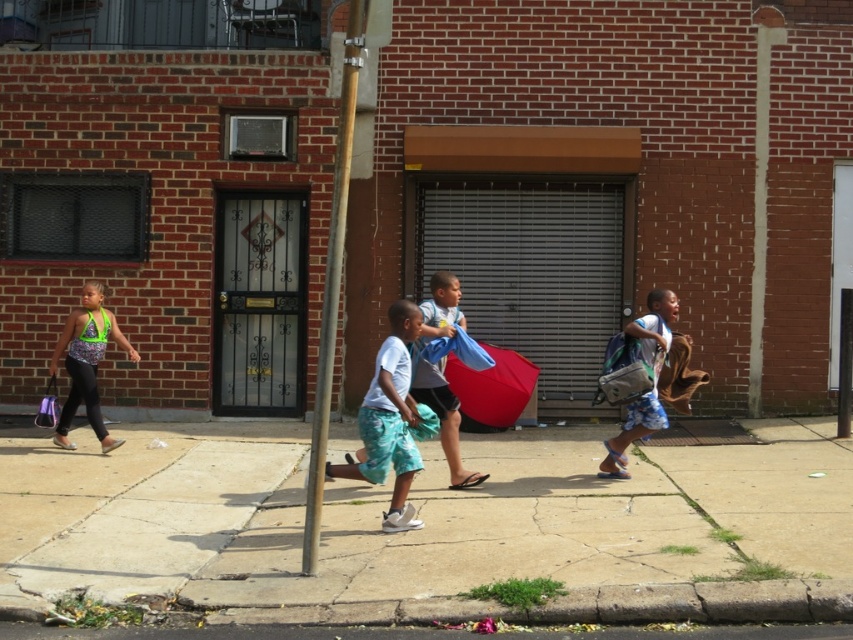
Question: Which point is farther to the camera?

Choices:
 (A) (326, 326)
 (B) (221, 385)

Answer: (B)

Question: Does black metal/gate at center appear on the left side of light blue cotton shorts at center?

Choices:
 (A) yes
 (B) no

Answer: (A)

Question: Can you confirm if smooth concrete sidewalk at center is positioned below matte purple shopping bag at lower left?

Choices:
 (A) no
 (B) yes

Answer: (B)

Question: In this image, where is light blue fabric at center located relative to blue denim shorts at right?

Choices:
 (A) above
 (B) below

Answer: (B)

Question: Which of these objects is positioned closest to the light blue cotton shorts at center?

Choices:
 (A) light blue fabric at center
 (B) metallic silver pole at center
 (C) metallic gray garage door at center
 (D) black metal/gate at center

Answer: (A)

Question: Which of the following is the farthest from the observer?

Choices:
 (A) (177, 480)
 (B) (424, 333)

Answer: (A)